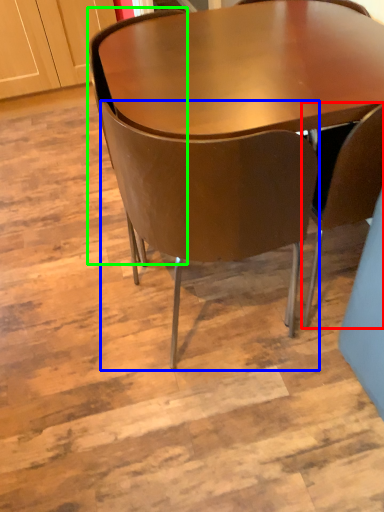
Question: Based on their relative distances, which object is farther from chair (highlighted by a red box)? Choose from chair (highlighted by a blue box) and chair (highlighted by a green box).

Choices:
 (A) chair
 (B) chair

Answer: (B)